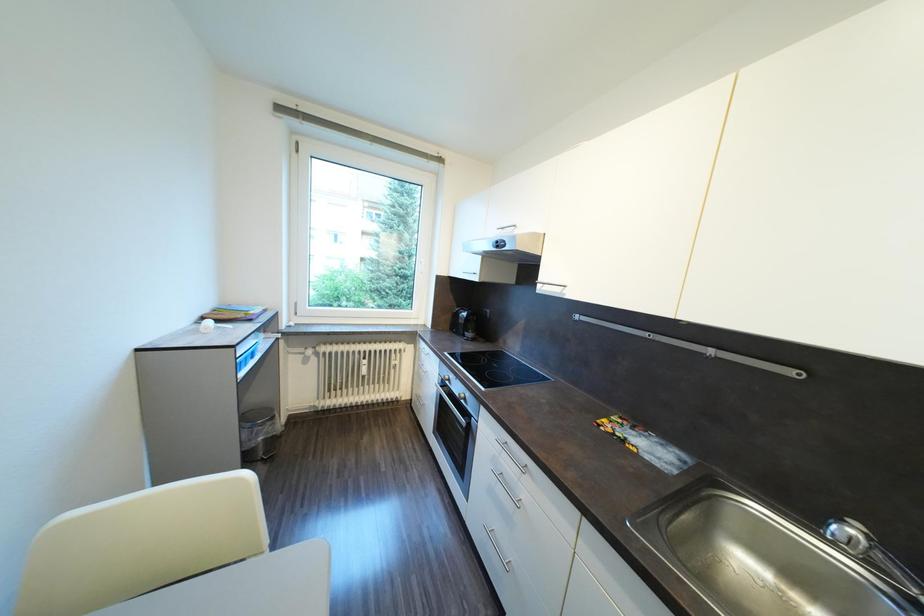
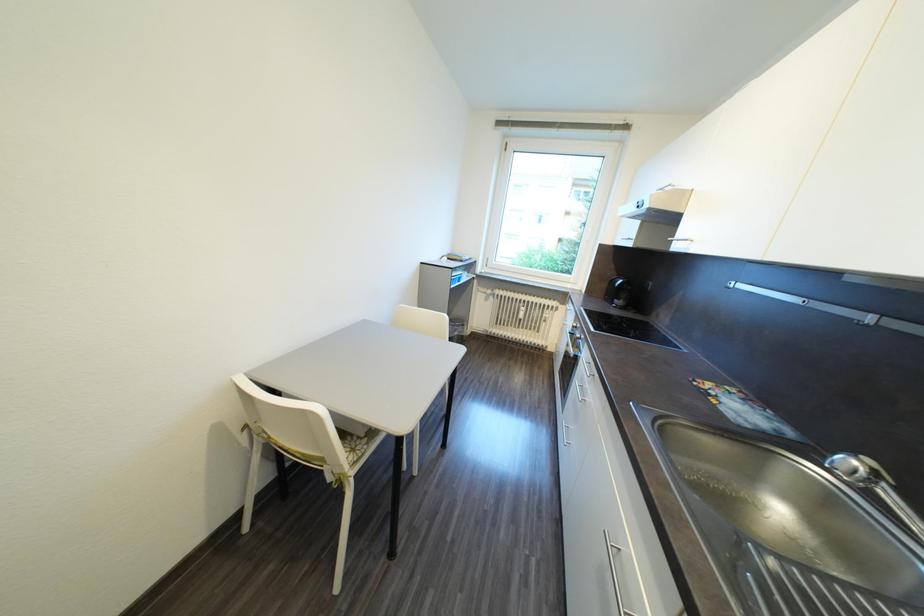
Question: How did the camera likely rotate?

Choices:
 (A) Left
 (B) Right
 (C) Up
 (D) Down

Answer: (A)